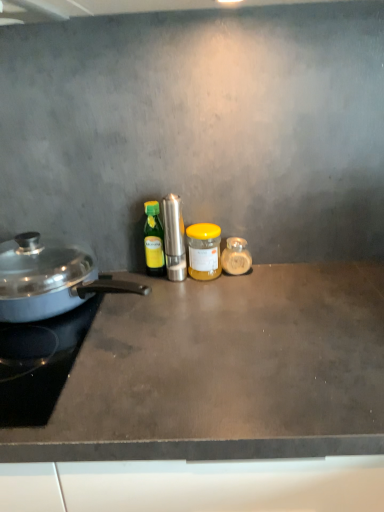
Where is `free space in front of shiny silver pan at left, placed as the 1th kitchen appliance when sorted from left to right`? The image size is (384, 512). free space in front of shiny silver pan at left, placed as the 1th kitchen appliance when sorted from left to right is located at coordinates (109, 389).